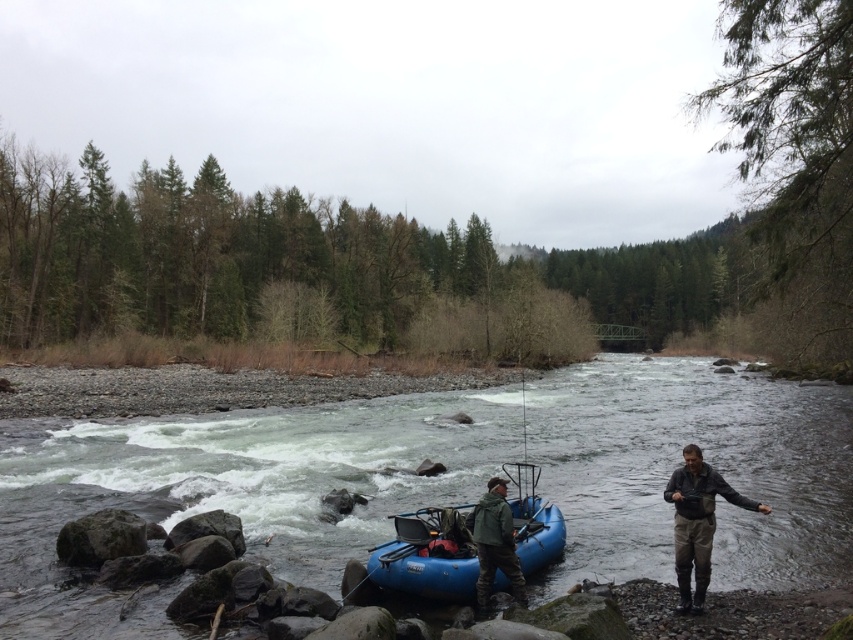
You are planning to take a photo of the blue rubber boat at center and the khaki cotton pants at lower right. Which object should you focus on first if you want to capture both in a single frame without moving the camera?

You should focus on the khaki cotton pants at lower right first because it occupies more space than the blue rubber boat at center, ensuring it fits well within the frame.

You are a hiker trying to determine which item is bigger between the khaki cotton pants at lower right and the green matte jacket at lower center. Based on the scene, which one takes up more space?

The khaki cotton pants at lower right is larger in size than the green matte jacket at lower center, so it takes up more space.